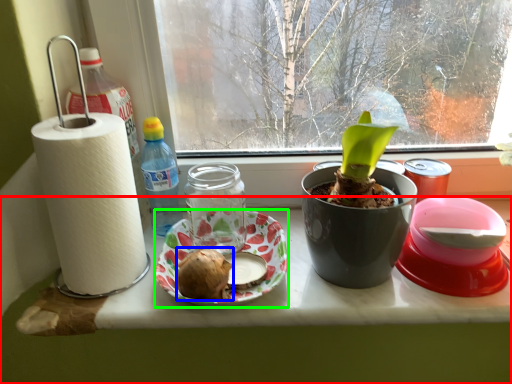
Question: Which is farther away from table (highlighted by a red box)? food (highlighted by a blue box) or platter (highlighted by a green box)?

Choices:
 (A) food
 (B) platter

Answer: (A)